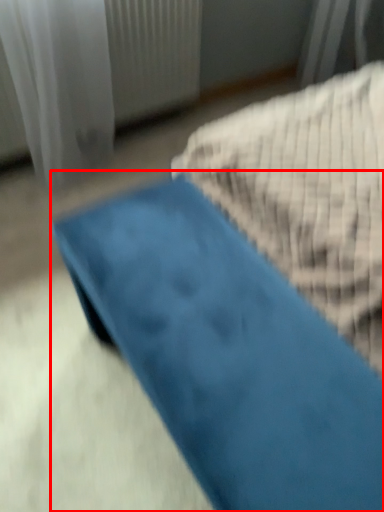
Question: From the image's perspective, where is furniture (annotated by the red box) located relative to curtain?

Choices:
 (A) below
 (B) above

Answer: (A)